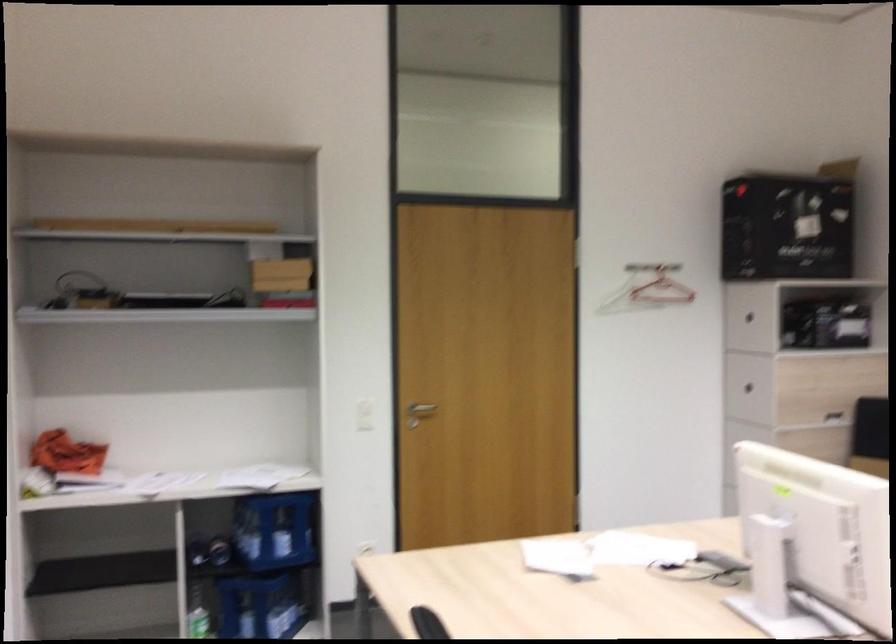
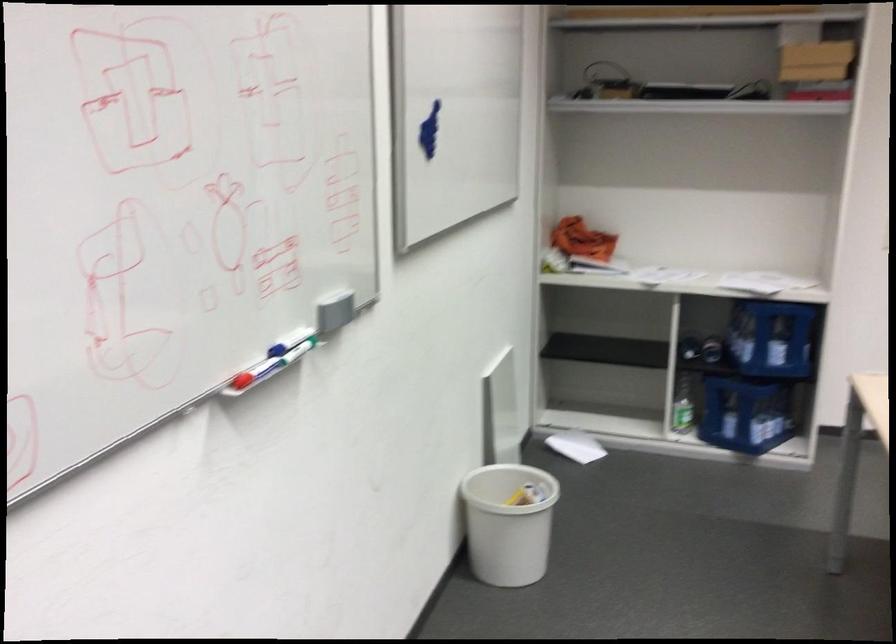
In the second image, find the point that corresponds to [161,480] in the first image.

(660, 275)